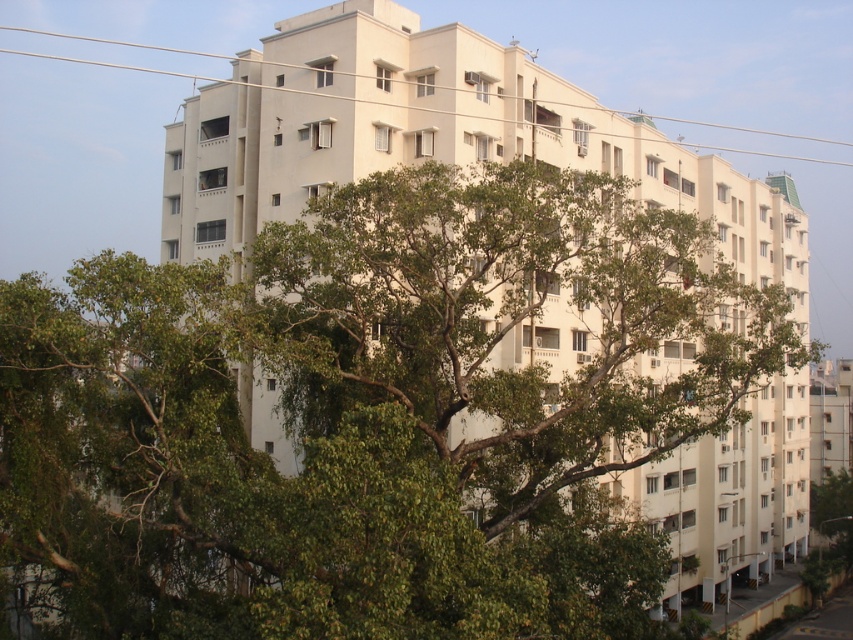
You are standing in front of the multi story residential building with a beige facade. You see a point marked at (369, 417). What does this point represent?

The point at (369, 417) represents the green leafy tree at center.

You are a drone operator trying to navigate your drone through the space between the green leafy tree at center and the white plastic power line at upper center. Can your drone, which has a wingspan of 1 meter, safely pass through this space?

The green leafy tree at center is narrower than the white plastic power line at upper center, so the space between them is wider than 1 meter. The drone can safely pass through this space.